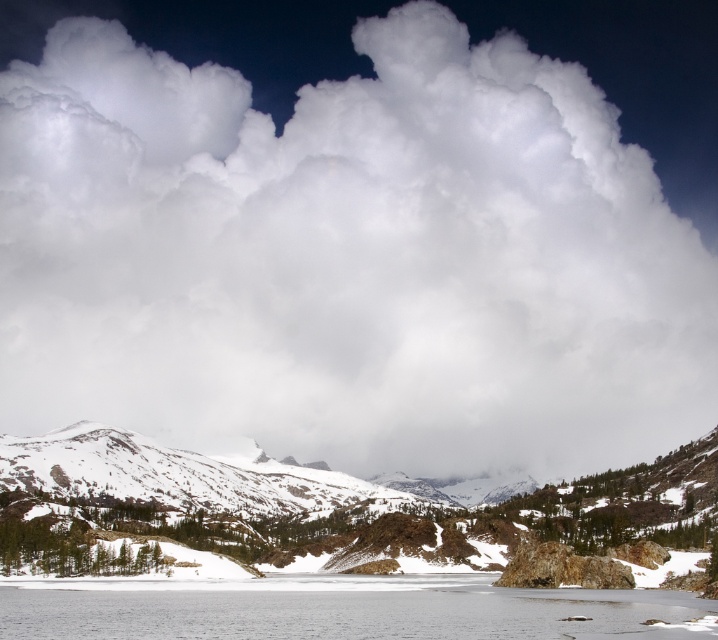
Question: In this image, where is snowy granite mountain at lower left located relative to clear ice water at lower center?

Choices:
 (A) right
 (B) left

Answer: (B)

Question: Which object is farther from the camera taking this photo?

Choices:
 (A) clear ice water at lower center
 (B) snowy granite mountain at lower left

Answer: (B)

Question: Can you confirm if snowy granite mountain at lower left is positioned to the right of clear ice water at lower center?

Choices:
 (A) no
 (B) yes

Answer: (A)

Question: Which object is closer to the camera taking this photo?

Choices:
 (A) clear ice water at lower center
 (B) snowy granite mountain at lower left

Answer: (A)

Question: Is snowy granite mountain at lower left to the left of clear ice water at lower center from the viewer's perspective?

Choices:
 (A) no
 (B) yes

Answer: (B)

Question: Which point is farther from the camera taking this photo?

Choices:
 (A) (230, 545)
 (B) (65, 612)

Answer: (A)